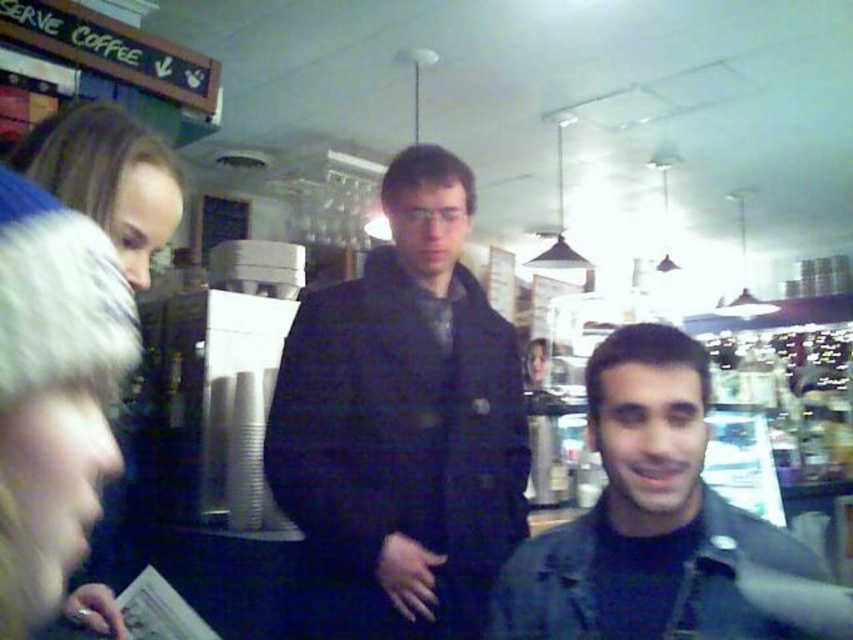
You are standing in a coffee shop and see the point marked at coordinates (660, 525). What object is located at that point?

The point at coordinates (660, 525) marks the location of the matte black jacket at lower right.

You are standing in the coffee shop and want to read the green painted wood signboard at upper left. The dark blue jacket at center is blocking your view. Can you move to the left to see the signboard better?

Yes, since the dark blue jacket at center is to the right of the green painted wood signboard at upper left, moving to the left would allow you to see the signboard without obstruction.

Looking at this image, you are a customer in the coffee shop and want to read the green painted wood signboard at upper left. There is a dark blue jacket at center blocking your view. Can you see the signboard clearly?

The dark blue jacket at center is taller than the green painted wood signboard at upper left, so it is likely blocking your view of the signboard.